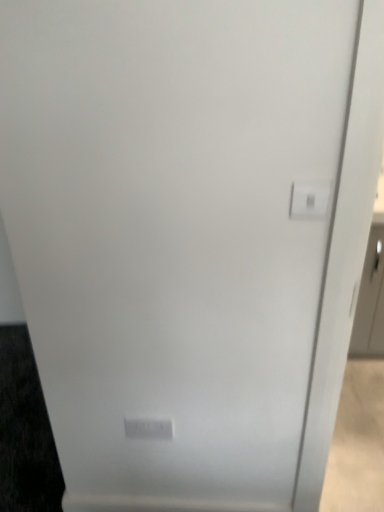
Question: Which direction should I rotate to look at white plastic light switch at lower center, the 2th light switch positioned from the front, — up or down?

Choices:
 (A) up
 (B) down

Answer: (B)

Question: Considering the relative positions of white plastic light switch at upper right, placed as the 2th light switch when sorted from bottom to top, and white plastic light switch at lower center, the 2th light switch positioned from the front, in the image provided, is white plastic light switch at upper right, placed as the 2th light switch when sorted from bottom to top, in front of white plastic light switch at lower center, the 2th light switch positioned from the front,?

Choices:
 (A) yes
 (B) no

Answer: (A)

Question: Is white plastic light switch at upper right, placed as the 2th light switch when sorted from bottom to top, oriented towards white plastic light switch at lower center, arranged as the second light switch when viewed from the top?

Choices:
 (A) no
 (B) yes

Answer: (A)

Question: From the image's perspective, is white plastic light switch at upper right, marked as the 1th light switch in a right-to-left arrangement, on white plastic light switch at lower center, the first light switch in the back-to-front sequence?

Choices:
 (A) yes
 (B) no

Answer: (A)

Question: Can you confirm if white plastic light switch at upper right, the first light switch viewed from the front, is positioned to the left of white plastic light switch at lower center, arranged as the 1th light switch when viewed from the left?

Choices:
 (A) yes
 (B) no

Answer: (B)

Question: Is white plastic light switch at upper right, marked as the 1th light switch in a right-to-left arrangement, placed right next to white plastic light switch at lower center, the first light switch when ordered from bottom to top?

Choices:
 (A) no
 (B) yes

Answer: (A)

Question: Could white plastic light switch at lower center, arranged as the second light switch when viewed from the right, be considered to be inside white plastic light switch at upper right, the first light switch viewed from the front?

Choices:
 (A) yes
 (B) no

Answer: (B)

Question: Is white plastic light switch at lower center, arranged as the second light switch when viewed from the right, positioned far away from white plastic light switch at upper right, the 1th light switch viewed from the top?

Choices:
 (A) yes
 (B) no

Answer: (B)

Question: Does white plastic light switch at lower center, arranged as the second light switch when viewed from the top, have a lesser width compared to white plastic light switch at upper right, marked as the 1th light switch in a right-to-left arrangement?

Choices:
 (A) no
 (B) yes

Answer: (B)

Question: From a real-world perspective, is white plastic light switch at lower center, arranged as the 1th light switch when viewed from the left, physically above white plastic light switch at upper right, the 2th light switch when ordered from left to right?

Choices:
 (A) yes
 (B) no

Answer: (B)

Question: Does white plastic light switch at lower center, the first light switch in the back-to-front sequence, have a greater width compared to white plastic light switch at upper right, the first light switch viewed from the front?

Choices:
 (A) yes
 (B) no

Answer: (B)

Question: Can we say white plastic light switch at lower center, the first light switch when ordered from bottom to top, lies outside white plastic light switch at upper right, marked as the 1th light switch in a right-to-left arrangement?

Choices:
 (A) no
 (B) yes

Answer: (B)

Question: Is the depth of white plastic light switch at lower center, arranged as the 1th light switch when viewed from the left, greater than that of white plastic light switch at upper right, the second light switch in the back-to-front sequence?

Choices:
 (A) no
 (B) yes

Answer: (B)

Question: Relative to white plastic light switch at lower center, arranged as the second light switch when viewed from the top, is white plastic light switch at upper right, the 2th light switch when ordered from left to right, in front or behind?

Choices:
 (A) front
 (B) behind

Answer: (A)